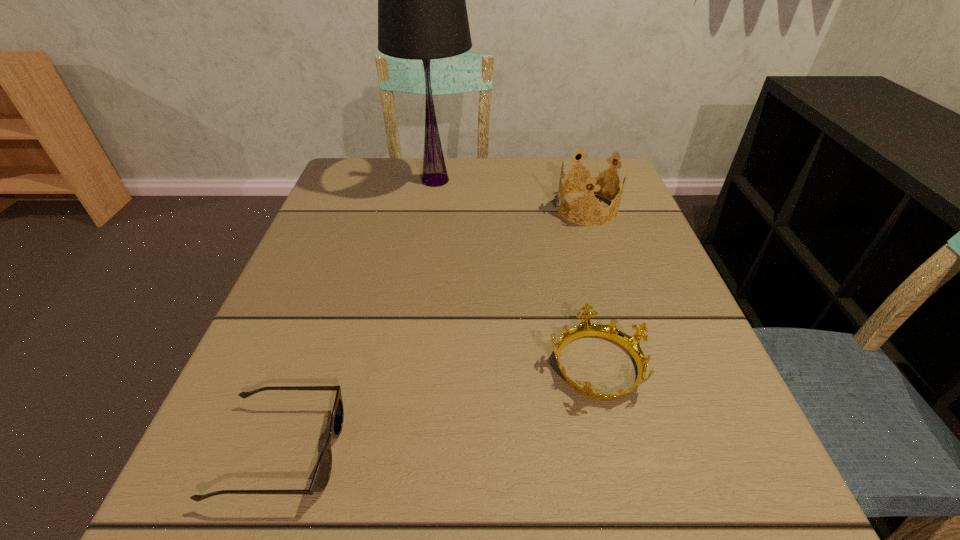
Where is `free space between the sunglasses and the lampshade`? free space between the sunglasses and the lampshade is located at coordinates (358, 316).

This screenshot has height=540, width=960. I want to click on empty space that is in between the nearer crown and the lampshade, so click(x=516, y=272).

Find the location of `free space between the lampshade and the sunglasses`. free space between the lampshade and the sunglasses is located at coordinates (358, 316).

You are a GUI agent. You are given a task and a screenshot of the screen. Output one action in this format:
    pyautogui.click(x=<x>, y=<y>)
    Task: Click on the free space between the nearer crown and the shortest object
    The image size is (960, 540).
    Given the screenshot: What is the action you would take?
    pyautogui.click(x=439, y=408)

This screenshot has width=960, height=540. What are the coordinates of `empty space between the tallest object and the shortest object` in the screenshot? It's located at (358, 316).

Select which object appears as the closest to the shortest object. Please provide its 2D coordinates. Your answer should be formatted as a tuple, i.e. [(x, y)], where the tuple contains the x and y coordinates of a point satisfying the conditions above.

[(586, 328)]

The width and height of the screenshot is (960, 540). I want to click on object that stands as the second closest to the second tallest object, so click(586, 328).

The image size is (960, 540). What are the coordinates of `blank area in the image that satisfies the following two spatial constraints: 1. on the front-facing side of the taller crown; 2. on the right side of the lampshade` in the screenshot? It's located at [x=431, y=208].

At what (x,y) coordinates should I click in order to perform the action: click on vacant region that satisfies the following two spatial constraints: 1. on the front-facing side of the lampshade; 2. on the back side of the nearer crown. Please return your answer as a coordinate pair (x, y). Looking at the image, I should click on (408, 364).

Where is `free space that satisfies the following two spatial constraints: 1. on the front-facing side of the lampshade; 2. on the left side of the shorter crown`? The image size is (960, 540). free space that satisfies the following two spatial constraints: 1. on the front-facing side of the lampshade; 2. on the left side of the shorter crown is located at coordinates (408, 364).